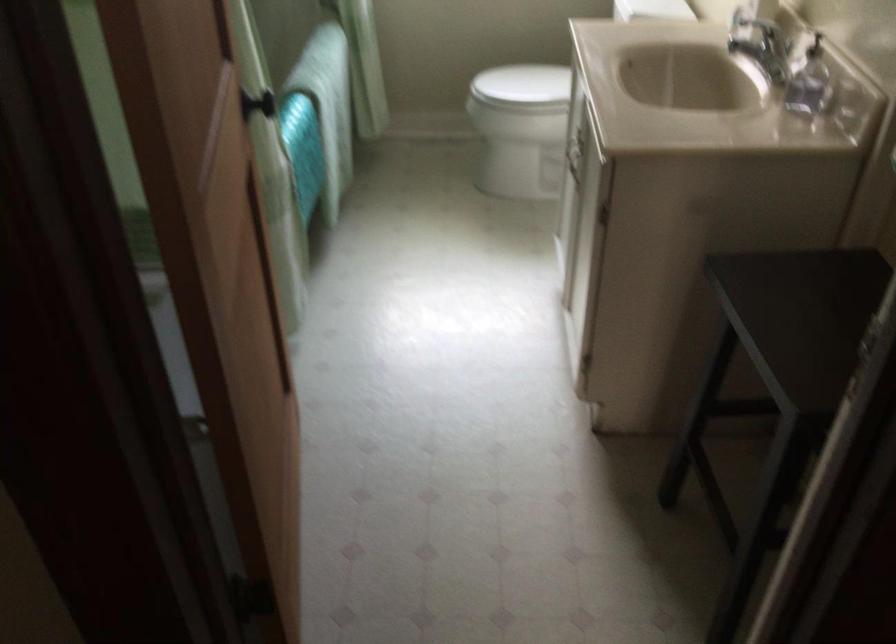
Find where to lift the white toilet lid. Please return your answer as a coordinate pair (x, y).

(522, 84)